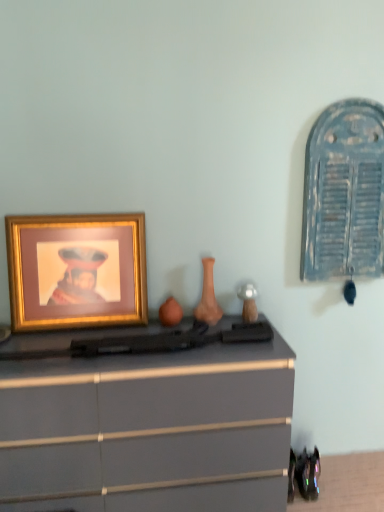
Question: Does gold metallic picture frame at left lie behind matte orange vase at center?

Choices:
 (A) no
 (B) yes

Answer: (A)

Question: From the image's perspective, is gold metallic picture frame at left below matte orange vase at center?

Choices:
 (A) yes
 (B) no

Answer: (B)

Question: Is gold metallic picture frame at left facing towards matte orange vase at center?

Choices:
 (A) yes
 (B) no

Answer: (B)

Question: Is gold metallic picture frame at left taller than matte orange vase at center?

Choices:
 (A) yes
 (B) no

Answer: (A)

Question: Does gold metallic picture frame at left have a lesser width compared to matte orange vase at center?

Choices:
 (A) yes
 (B) no

Answer: (A)

Question: From the image's perspective, is gold metallic picture frame at left above or below matte gray chest of drawers at center?

Choices:
 (A) below
 (B) above

Answer: (B)

Question: Does point (18, 288) appear closer or farther from the camera than point (187, 401)?

Choices:
 (A) closer
 (B) farther

Answer: (B)

Question: From a real-world perspective, relative to matte gray chest of drawers at center, is gold metallic picture frame at left vertically above or below?

Choices:
 (A) above
 (B) below

Answer: (A)

Question: Is gold metallic picture frame at left inside or outside of matte gray chest of drawers at center?

Choices:
 (A) inside
 (B) outside

Answer: (B)

Question: Considering the positions of matte gray chest of drawers at center and gold metallic picture frame at left in the image, is matte gray chest of drawers at center wider or thinner than gold metallic picture frame at left?

Choices:
 (A) wide
 (B) thin

Answer: (A)

Question: Would you say matte gray chest of drawers at center is to the left or to the right of gold metallic picture frame at left in the picture?

Choices:
 (A) left
 (B) right

Answer: (B)

Question: From the image's perspective, is matte gray chest of drawers at center above or below gold metallic picture frame at left?

Choices:
 (A) above
 (B) below

Answer: (B)

Question: Is matte gray chest of drawers at center bigger or smaller than gold metallic picture frame at left?

Choices:
 (A) small
 (B) big

Answer: (B)

Question: In terms of width, does matte orange vase at center look wider or thinner when compared to gold metallic picture frame at left?

Choices:
 (A) wide
 (B) thin

Answer: (A)

Question: Considering the relative positions of matte orange vase at center and gold metallic picture frame at left in the image provided, is matte orange vase at center to the left or to the right of gold metallic picture frame at left?

Choices:
 (A) right
 (B) left

Answer: (A)